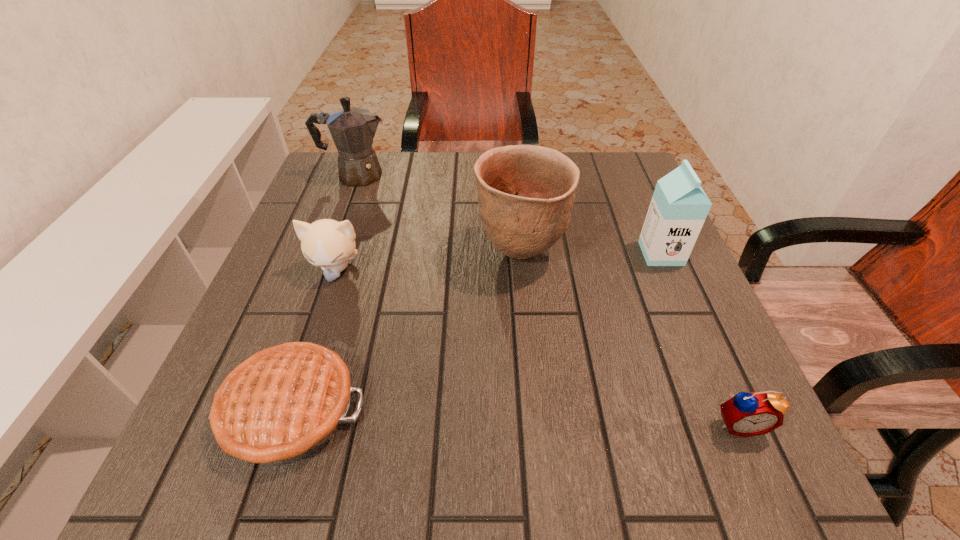
Locate an element on the screen. vacant region located 0.080m on the back of the pie is located at coordinates (321, 321).

Find the location of a particular element. Image resolution: width=960 pixels, height=540 pixels. object that is at the far edge is located at coordinates (353, 129).

Locate an element on the screen. This screenshot has height=540, width=960. alarm clock that is positioned at the near edge is located at coordinates (745, 414).

Locate an element on the screen. This screenshot has height=540, width=960. pie that is positioned at the near edge is located at coordinates (282, 404).

Image resolution: width=960 pixels, height=540 pixels. I want to click on coffeepot located in the left edge section of the desktop, so click(353, 129).

The height and width of the screenshot is (540, 960). What are the coordinates of `kitten at the left edge` in the screenshot? It's located at (326, 243).

Locate an element on the screen. This screenshot has height=540, width=960. pie located in the left edge section of the desktop is located at coordinates (282, 404).

Identify the location of milk carton present at the right edge. Image resolution: width=960 pixels, height=540 pixels. (679, 206).

Where is `alarm clock located at the right edge`? The height and width of the screenshot is (540, 960). alarm clock located at the right edge is located at coordinates (745, 414).

Find the location of a particular element. object that is at the far left corner is located at coordinates (353, 129).